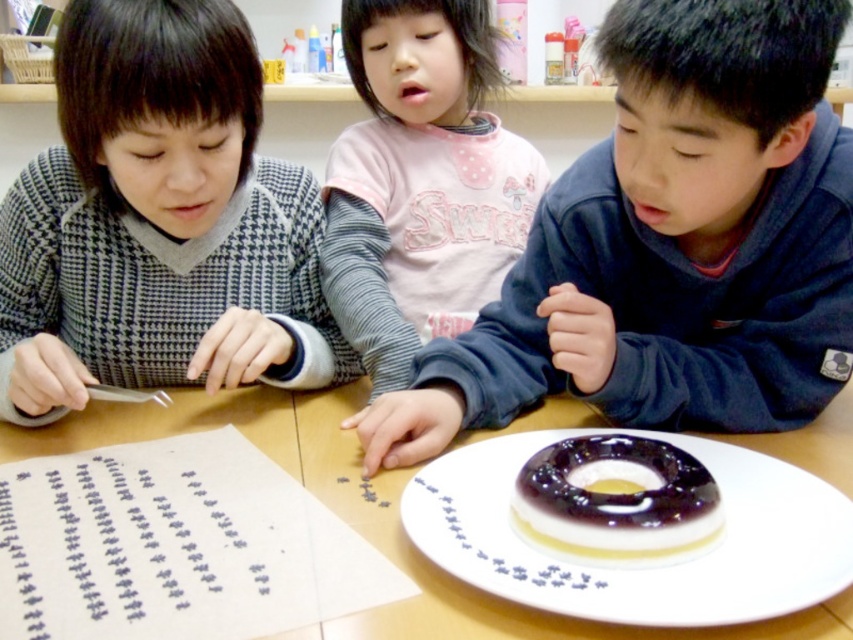
Between pink cotton shirt at center and translucent jelly ring at center, which one has less height?

With less height is translucent jelly ring at center.

Who is higher up, pink cotton shirt at center or translucent jelly ring at center?

pink cotton shirt at center is above.

What do you see at coordinates (421, 179) in the screenshot? I see `pink cotton shirt at center` at bounding box center [421, 179].

The height and width of the screenshot is (640, 853). I want to click on pink cotton shirt at center, so click(x=421, y=179).

Which is behind, point (796, 305) or point (109, 428)?

Positioned behind is point (109, 428).

The height and width of the screenshot is (640, 853). Describe the element at coordinates (671, 244) in the screenshot. I see `matte blue sweater at center` at that location.

I want to click on matte blue sweater at center, so click(671, 244).

Find the location of a particular element. The width and height of the screenshot is (853, 640). matte blue sweater at center is located at coordinates (671, 244).

Is gray houndstooth sweater at left thinner than pink cotton shirt at center?

Incorrect, gray houndstooth sweater at left's width is not less than pink cotton shirt at center's.

This screenshot has width=853, height=640. What do you see at coordinates (160, 221) in the screenshot? I see `gray houndstooth sweater at left` at bounding box center [160, 221].

Locate an element on the screen. gray houndstooth sweater at left is located at coordinates (160, 221).